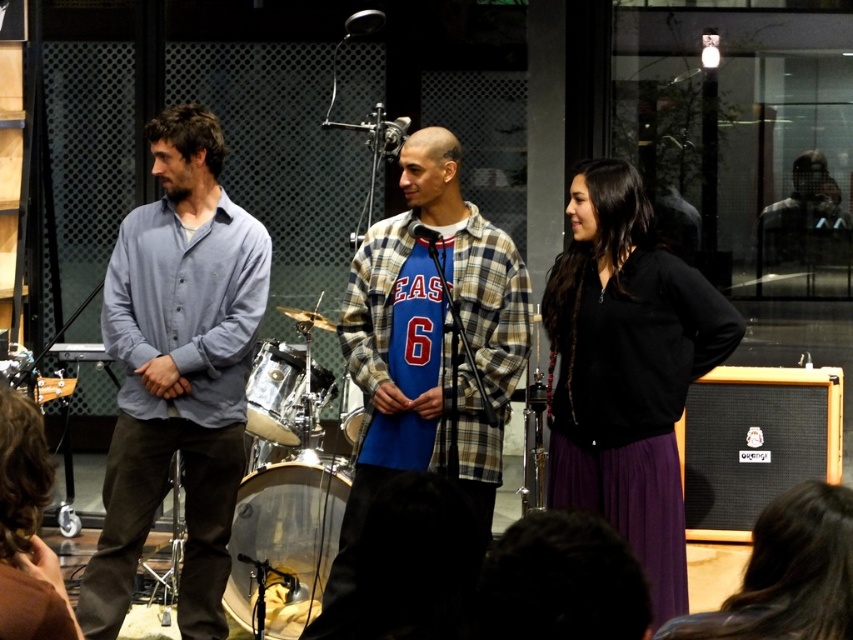
Which is behind, point (38, 580) or point (354, 397)?

Positioned behind is point (354, 397).

Where is `curly hair at center`? This screenshot has width=853, height=640. curly hair at center is located at coordinates (27, 529).

Identify the location of curly hair at center. (27, 529).

Is matte blue shirt at center to the left of clear plastic drum at center from the viewer's perspective?

Correct, you'll find matte blue shirt at center to the left of clear plastic drum at center.

Does matte blue shirt at center have a lesser width compared to clear plastic drum at center?

In fact, matte blue shirt at center might be wider than clear plastic drum at center.

Is point (114, 248) positioned in front of point (265, 548)?

Yes, point (114, 248) is closer to viewer.

This screenshot has height=640, width=853. Find the location of `matte blue shirt at center`. matte blue shirt at center is located at coordinates (177, 372).

Who is positioned more to the right, black matte sweatshirt at center or shiny silver drum at center?

black matte sweatshirt at center is more to the right.

Between black matte sweatshirt at center and shiny silver drum at center, which one appears on the left side from the viewer's perspective?

From the viewer's perspective, shiny silver drum at center appears more on the left side.

Is point (564, 433) behind point (292, 346)?

That is False.

At what (x,y) coordinates should I click in order to perform the action: click on black matte sweatshirt at center. Please return your answer as a coordinate pair (x, y). The width and height of the screenshot is (853, 640). Looking at the image, I should click on (625, 371).